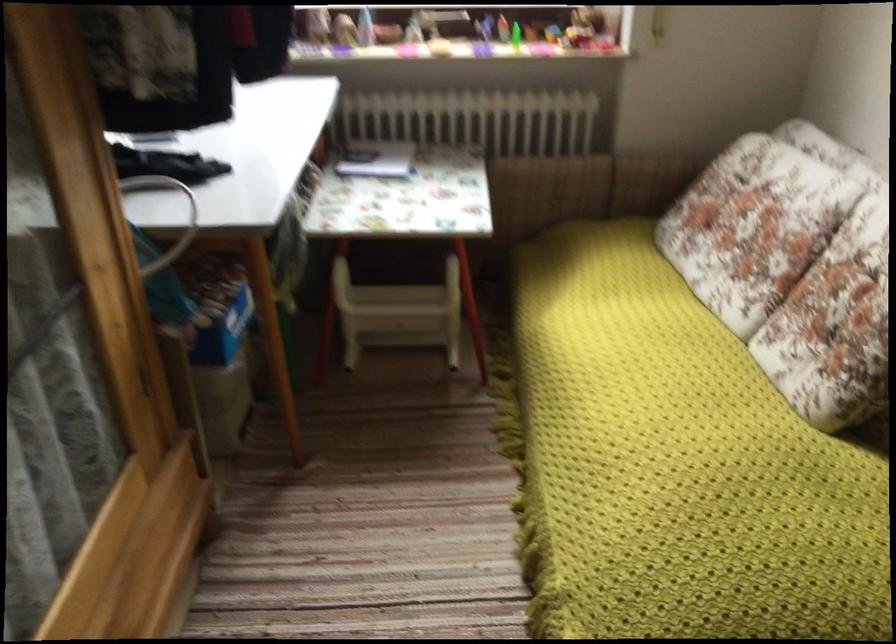
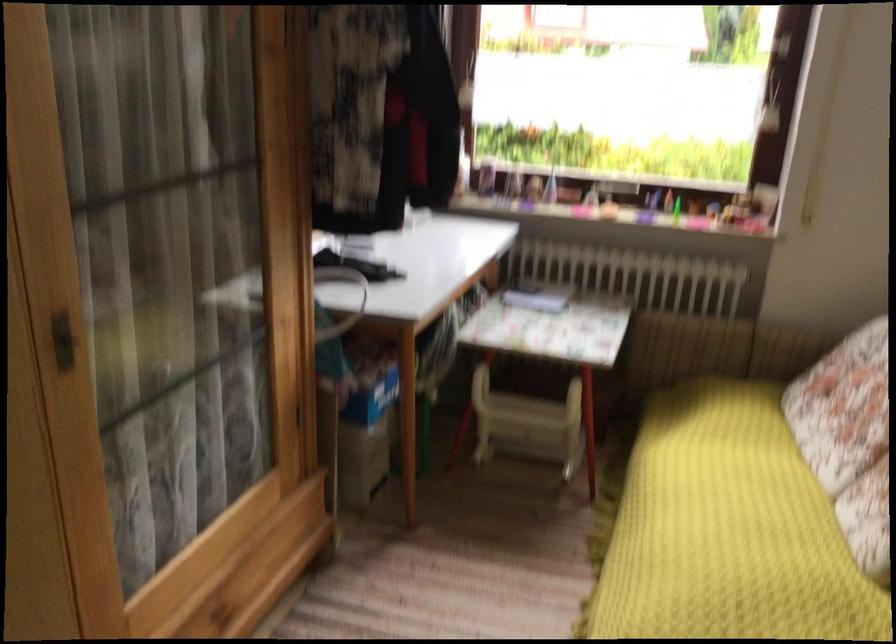
Where in the second image is the point corresponding to point (741, 274) from the first image?

(849, 439)